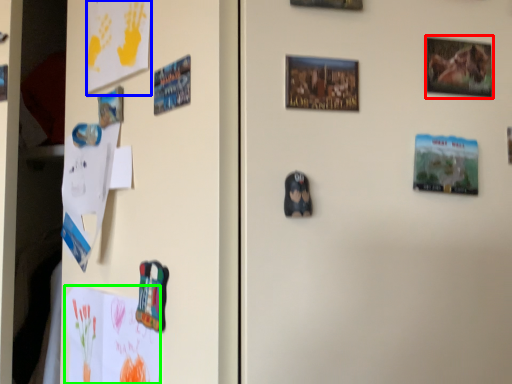
Question: Estimate the real-world distances between objects in this image. Which object is farther from picture frame (highlighted by a red box), postcard (highlighted by a blue box) or postcard (highlighted by a green box)?

Choices:
 (A) postcard
 (B) postcard

Answer: (B)